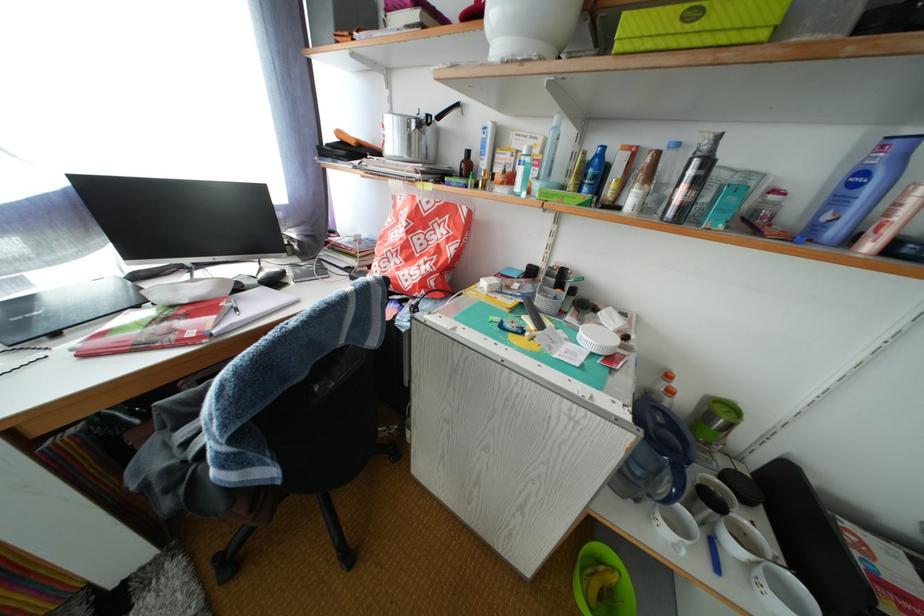
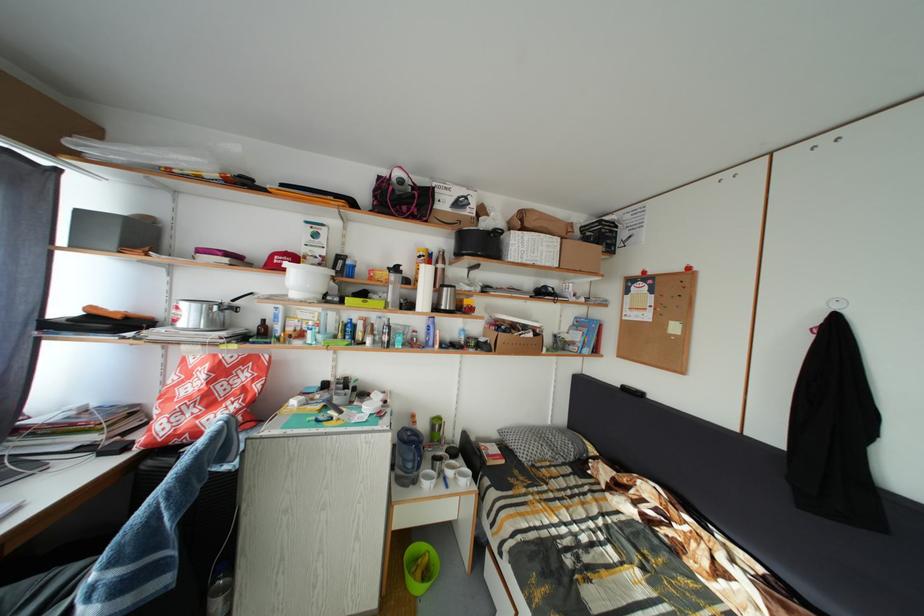
Question: The images are taken continuously from a first-person perspective. In which direction is your viewpoint rotating?

Choices:
 (A) Left
 (B) Right
 (C) Up
 (D) Down

Answer: (B)